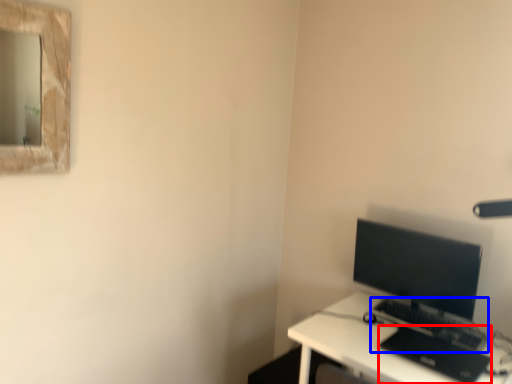
Question: Which object appears farthest to the camera in this image, laptop (highlighted by a red box) or computer keyboard (highlighted by a blue box)?

Choices:
 (A) laptop
 (B) computer keyboard

Answer: (B)